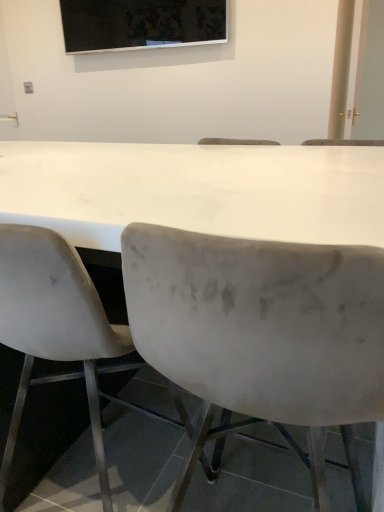
Question: From a real-world perspective, is white matte chair at left, arranged as the 2th chair when viewed from the right, under black glossy screen at upper center?

Choices:
 (A) yes
 (B) no

Answer: (A)

Question: Is white matte chair at left, arranged as the 2th chair when viewed from the right, directly adjacent to black glossy screen at upper center?

Choices:
 (A) yes
 (B) no

Answer: (B)

Question: Is white matte chair at left, positioned as the first chair in left-to-right order, turned away from black glossy screen at upper center?

Choices:
 (A) no
 (B) yes

Answer: (A)

Question: Is white matte chair at left, positioned as the first chair in left-to-right order, completely or partially outside of black glossy screen at upper center?

Choices:
 (A) yes
 (B) no

Answer: (A)

Question: Considering the relative sizes of white matte chair at left, arranged as the 2th chair when viewed from the right, and black glossy screen at upper center in the image provided, is white matte chair at left, arranged as the 2th chair when viewed from the right, smaller than black glossy screen at upper center?

Choices:
 (A) no
 (B) yes

Answer: (A)

Question: Considering the positions of point (271, 334) and point (360, 31), is point (271, 334) closer or farther from the camera than point (360, 31)?

Choices:
 (A) farther
 (B) closer

Answer: (B)

Question: Looking at their shapes, would you say velvet gray chair at center, the second chair when ordered from left to right, is wider or thinner than white glossy door at upper right?

Choices:
 (A) thin
 (B) wide

Answer: (B)

Question: Based on their sizes in the image, would you say velvet gray chair at center, which is counted as the 1th chair, starting from the right, is bigger or smaller than white glossy door at upper right?

Choices:
 (A) small
 (B) big

Answer: (B)

Question: Which is correct: velvet gray chair at center, which is counted as the 1th chair, starting from the right, is inside white glossy door at upper right, or outside of it?

Choices:
 (A) inside
 (B) outside

Answer: (B)

Question: Considering the positions of white matte chair at left, positioned as the first chair in left-to-right order, and black glossy screen at upper center in the image, is white matte chair at left, positioned as the first chair in left-to-right order, bigger or smaller than black glossy screen at upper center?

Choices:
 (A) small
 (B) big

Answer: (B)

Question: Considering their positions, is white matte chair at left, positioned as the first chair in left-to-right order, located in front of or behind black glossy screen at upper center?

Choices:
 (A) front
 (B) behind

Answer: (A)

Question: From their relative heights in the image, would you say white matte chair at left, arranged as the 2th chair when viewed from the right, is taller or shorter than black glossy screen at upper center?

Choices:
 (A) short
 (B) tall

Answer: (B)

Question: Visually, is white matte chair at left, positioned as the first chair in left-to-right order, positioned to the left or to the right of black glossy screen at upper center?

Choices:
 (A) left
 (B) right

Answer: (B)

Question: Relative to black glossy screen at upper center, is white glossy door at upper right in front or behind?

Choices:
 (A) front
 (B) behind

Answer: (B)

Question: From their relative heights in the image, would you say white glossy door at upper right is taller or shorter than black glossy screen at upper center?

Choices:
 (A) short
 (B) tall

Answer: (B)